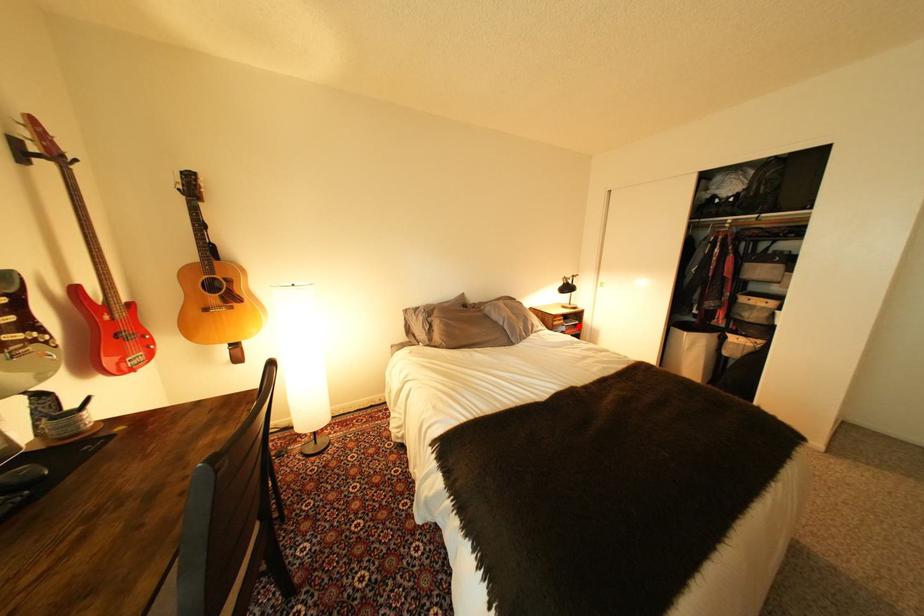
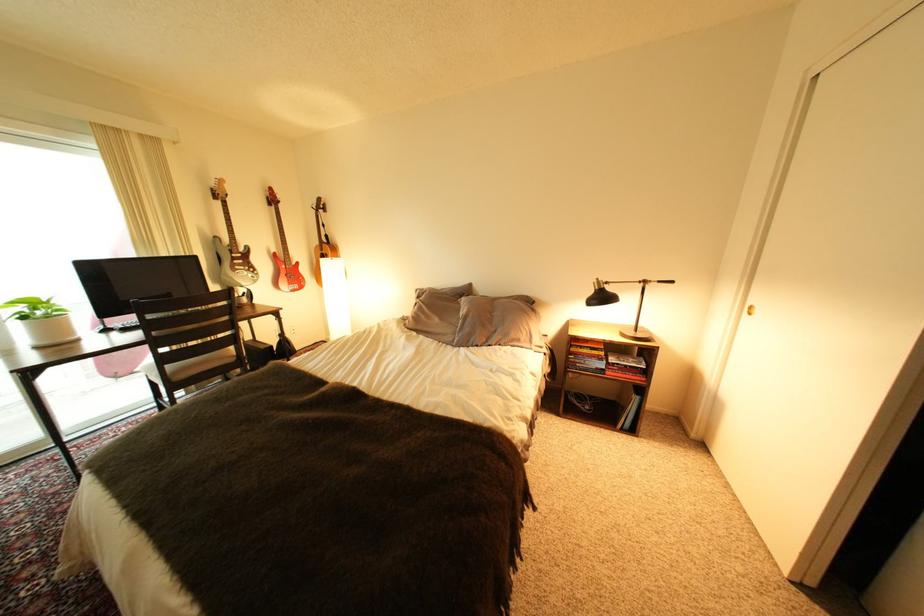
Find the pixel in the second image that matches the highlighted location in the first image.

(623, 363)